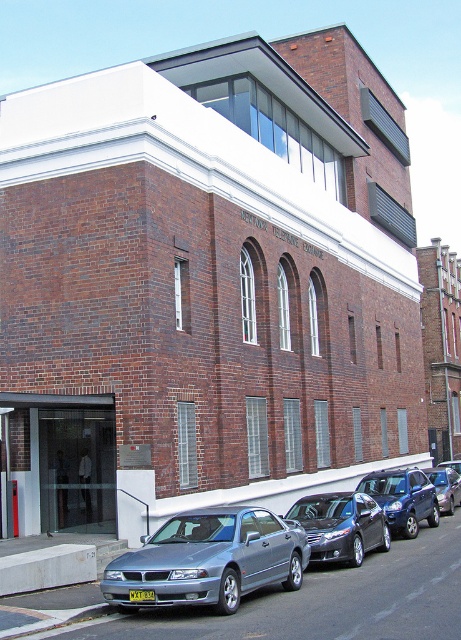
Does concrete at lower left appear under metallic silver sedan at center?

No, concrete at lower left is not below metallic silver sedan at center.

The height and width of the screenshot is (640, 461). Describe the element at coordinates (47, 566) in the screenshot. I see `concrete at lower left` at that location.

Where is `concrete at lower left`? The height and width of the screenshot is (640, 461). concrete at lower left is located at coordinates (47, 566).

Who is more distant from viewer, (414,467) or (142,596)?

Positioned behind is point (414,467).

Where is `satin black suv at center`? The image size is (461, 640). satin black suv at center is located at coordinates (402, 499).

Between satin silver sedan at lower center and yellow matte license plate at center, which one is positioned lower?

Positioned lower is satin silver sedan at lower center.

Who is positioned more to the left, satin silver sedan at lower center or yellow matte license plate at center?

yellow matte license plate at center is more to the left.

Is point (191, 538) positioned behind point (153, 596)?

Yes, it is.

The width and height of the screenshot is (461, 640). Find the location of `satin silver sedan at lower center`. satin silver sedan at lower center is located at coordinates (210, 560).